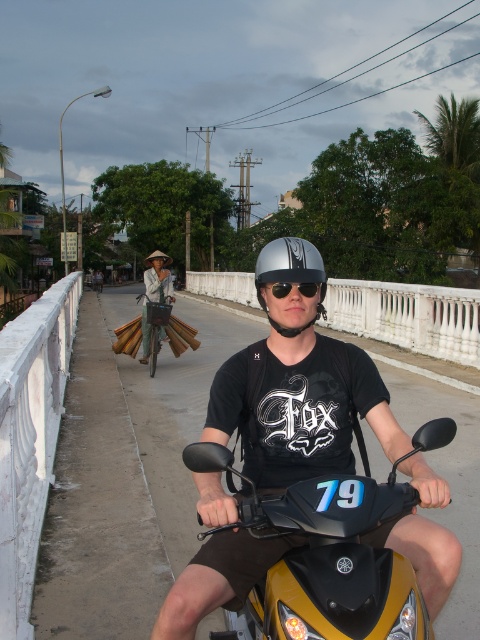
You are standing at the point marked as point (215, 593) on the bridge. You want to take a photo of the scooter rider. The camera you have can focus on objects up to 2 meters away. Will the camera be able to capture the rider clearly?

The distance between point (215, 593) and the camera is 1.87 meters, which is within the camera focus range of up to 2 meters. Therefore, the camera will be able to capture the rider clearly.